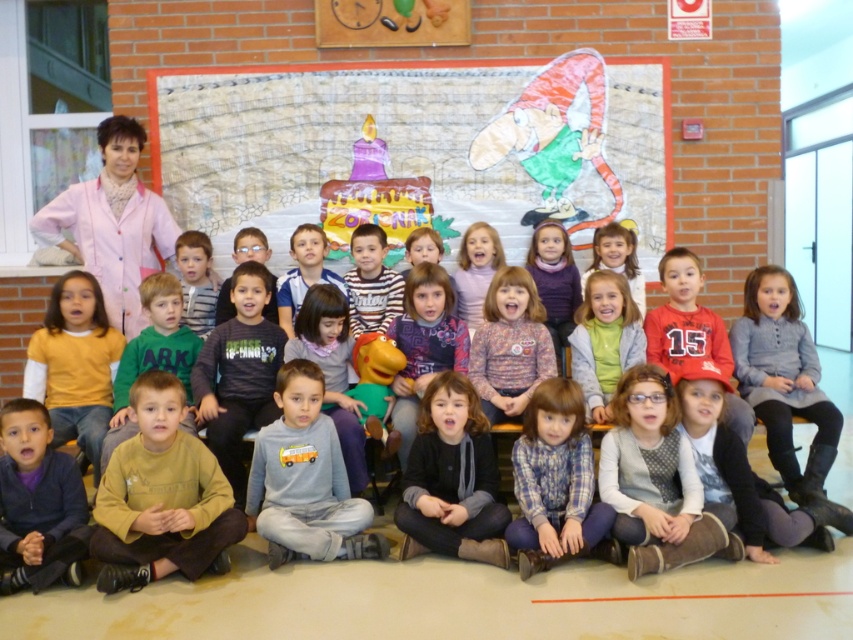
You are a photographer adjusting your camera to focus on the brown cotton shirt at center and the dark blue fleece jacket at lower left. Which one will appear larger in the photo?

The brown cotton shirt at center will appear larger in the photo because it is closer to the viewer than the dark blue fleece jacket at lower left.

You are a student in the classroom and want to hang a new poster on the wall. The new poster must be placed to the right of the cartoonish paper collage at upper center. Where should you place it?

The cartoonish paper collage at upper center is located at point (x=418, y=148). To place the new poster to the right of it, you should position it at a coordinate with an x value greater than 0.233 while keeping the y value around 0.491.